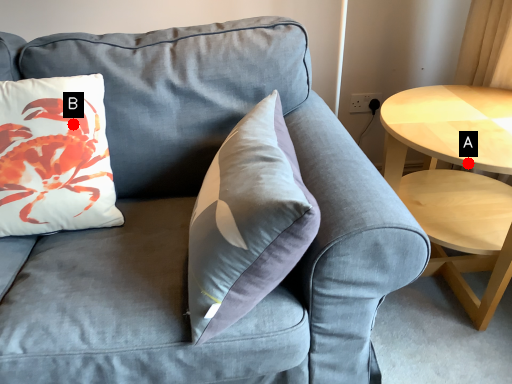
Question: Two points are circled on the image, labeled by A and B beside each circle. Which point is closer to the camera?

Choices:
 (A) A is closer
 (B) B is closer

Answer: (B)